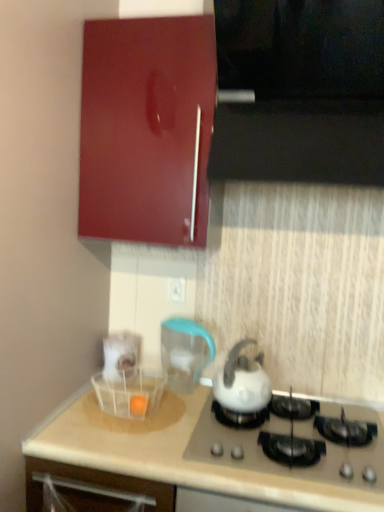
What is the approximate width of white glossy gas stove at lower center?

white glossy gas stove at lower center is 21.33 inches in width.

This screenshot has width=384, height=512. I want to click on white glossy gas stove at lower center, so click(288, 434).

Describe the element at coordinates (301, 91) in the screenshot. I see `black glossy vent at upper center` at that location.

This screenshot has width=384, height=512. Describe the element at coordinates (121, 357) in the screenshot. I see `clear plastic container at center` at that location.

Measure the distance between point (132,337) and camera.

The depth of point (132,337) is 5.58 feet.

Identify the location of transparent plastic blender at center. This screenshot has height=512, width=384. (185, 352).

This screenshot has height=512, width=384. Find the location of `white glossy gas stove at lower center`. white glossy gas stove at lower center is located at coordinates (288, 434).

Is white plastic electric outlet at center next to white glossy kettle at center and touching it?

No, white plastic electric outlet at center is not in contact with white glossy kettle at center.

What's the angular difference between white plastic electric outlet at center and white glossy kettle at center's facing directions?

They differ by 1.51 degrees in their facing directions.

Looking at the image, does white plastic electric outlet at center seem bigger or smaller compared to white glossy kettle at center?

white plastic electric outlet at center is smaller than white glossy kettle at center.

From a real-world perspective, is white plastic electric outlet at center physically located above or below white glossy kettle at center?

white plastic electric outlet at center is above white glossy kettle at center.

What's the angular difference between transparent plastic blender at center and transparent plastic basket at lower center's facing directions?

0.000103 degrees.

Is transparent plastic blender at center looking in the opposite direction of transparent plastic basket at lower center?

No, transparent plastic blender at center is not facing the opposite direction of transparent plastic basket at lower center.

Who is bigger, transparent plastic blender at center or transparent plastic basket at lower center?

With larger size is transparent plastic blender at center.

From a real-world perspective, is glossy wood cabinet at upper left located higher than black glossy vent at upper center?

No, from a real-world perspective, glossy wood cabinet at upper left is not above black glossy vent at upper center.

Would you say black glossy vent at upper center is part of glossy wood cabinet at upper left's contents?

That's incorrect, black glossy vent at upper center is not inside glossy wood cabinet at upper left.

Who is bigger, glossy wood cabinet at upper left or black glossy vent at upper center?

glossy wood cabinet at upper left is bigger.

Does white plastic electric outlet at center have a lesser width compared to transparent plastic basket at lower center?

Yes, white plastic electric outlet at center is thinner than transparent plastic basket at lower center.

Who is bigger, white plastic electric outlet at center or transparent plastic basket at lower center?

With larger size is transparent plastic basket at lower center.

Is white plastic electric outlet at center not inside transparent plastic basket at lower center?

That's correct, white plastic electric outlet at center is outside of transparent plastic basket at lower center.

Between point (169, 280) and point (110, 392), which one is positioned behind?

The point (169, 280) is behind.

Measure the distance between white plastic drawer at lower left and clear plastic container at center.

white plastic drawer at lower left and clear plastic container at center are 16.41 inches apart from each other.

From the image's perspective, is white plastic drawer at lower left located above or below clear plastic container at center?

Clearly, from the image's perspective, white plastic drawer at lower left is below clear plastic container at center.

Is clear plastic container at center located within white plastic drawer at lower left?

No, clear plastic container at center is not a part of white plastic drawer at lower left.

Can you confirm if white plastic drawer at lower left is positioned to the left of clear plastic container at center?

No.

Which object is positioned more to the left, black glossy vent at upper center or clear plastic container at center?

clear plastic container at center.

From a real-world perspective, is black glossy vent at upper center physically above clear plastic container at center?

Yes, from a real-world perspective, black glossy vent at upper center is on top of clear plastic container at center.

Is black glossy vent at upper center oriented towards clear plastic container at center?

No, black glossy vent at upper center is not facing towards clear plastic container at center.

In terms of height, does black glossy vent at upper center look taller or shorter compared to clear plastic container at center?

Considering their sizes, black glossy vent at upper center has more height than clear plastic container at center.

Is white glossy gas stove at lower center at the back of white glossy kettle at center?

No.

Looking at this image, how many degrees apart are the facing directions of white glossy kettle at center and white glossy gas stove at lower center?

There is a 1.56-degree angle between the facing directions of white glossy kettle at center and white glossy gas stove at lower center.

Which is closer, (265,382) or (241,434)?

Point (265,382) appears to be farther away from the viewer than point (241,434).

Locate an element on the screen. electric outlet that appears above the white glossy kettle at center (from the image's perspective) is located at coordinates (176, 290).

At what (x,y) coordinates should I click in order to perform the action: click on basket located below the transparent plastic blender at center (from the image's perspective). Please return your answer as a coordinate pair (x, y). This screenshot has height=512, width=384. Looking at the image, I should click on (130, 393).

Estimate the real-world distances between objects in this image. Which object is closer to white plastic drawer at lower left, black glossy vent at upper center or white glossy gas stove at lower center?

white glossy gas stove at lower center is positioned closer to the anchor white plastic drawer at lower left.

Looking at the image, which one is located closer to white plastic electric outlet at center, transparent plastic basket at lower center or black glossy vent at upper center?

The object closer to white plastic electric outlet at center is transparent plastic basket at lower center.

From the picture: Estimate the real-world distances between objects in this image. Which object is further from transparent plastic blender at center, black glossy vent at upper center or white glossy kettle at center?

black glossy vent at upper center is further to transparent plastic blender at center.

Considering their positions, is white plastic drawer at lower left positioned closer to transparent plastic blender at center than white glossy gas stove at lower center?

The object closer to transparent plastic blender at center is white glossy gas stove at lower center.

Estimate the real-world distances between objects in this image. Which object is closer to clear plastic container at center, white plastic electric outlet at center or white glossy gas stove at lower center?

white plastic electric outlet at center is positioned closer to the anchor clear plastic container at center.

When comparing their distances from white glossy gas stove at lower center, does white plastic electric outlet at center or white plastic drawer at lower left seem further?

The object further to white glossy gas stove at lower center is white plastic electric outlet at center.

When comparing their distances from white plastic drawer at lower left, does clear plastic container at center or black glossy vent at upper center seem closer?

The object closer to white plastic drawer at lower left is clear plastic container at center.

From the picture: From the image, which object appears to be nearer to transparent plastic blender at center, white plastic drawer at lower left or clear plastic container at center?

Based on the image, clear plastic container at center appears to be nearer to transparent plastic blender at center.

The width and height of the screenshot is (384, 512). I want to click on drawer situated between clear plastic container at center and white glossy gas stove at lower center from left to right, so 95,488.

What are the coordinates of `cabinetry between black glossy vent at upper center and transparent plastic blender at center from top to bottom` in the screenshot? It's located at (147, 129).

Identify the location of kettle between white plastic drawer at lower left and clear plastic container at center from front to back. (242, 383).

The height and width of the screenshot is (512, 384). Identify the location of basket between black glossy vent at upper center and white glossy gas stove at lower center from top to bottom. (130, 393).